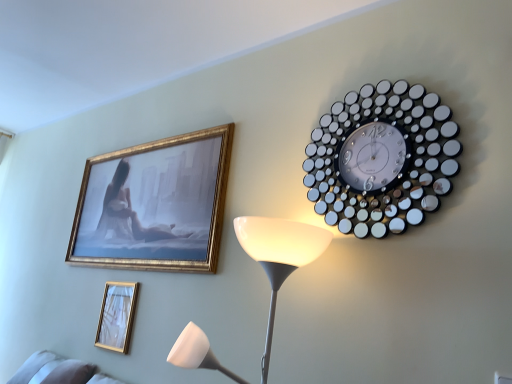
Question: From their relative heights in the image, would you say gold metallic picture frame at lower left is taller or shorter than metallic circular clock at upper right?

Choices:
 (A) tall
 (B) short

Answer: (B)

Question: Based on their sizes in the image, would you say gold metallic picture frame at lower left is bigger or smaller than metallic circular clock at upper right?

Choices:
 (A) big
 (B) small

Answer: (B)

Question: From the image's perspective, is gold metallic picture frame at lower left positioned above or below metallic circular clock at upper right?

Choices:
 (A) below
 (B) above

Answer: (A)

Question: Is point (437, 119) positioned closer to the camera than point (136, 296)?

Choices:
 (A) closer
 (B) farther

Answer: (A)

Question: Is metallic circular clock at upper right inside or outside of gold metallic picture frame at lower left?

Choices:
 (A) inside
 (B) outside

Answer: (B)

Question: From the image's perspective, is metallic circular clock at upper right above or below gold metallic picture frame at lower left?

Choices:
 (A) above
 (B) below

Answer: (A)

Question: Considering the positions of metallic circular clock at upper right and gold metallic picture frame at lower left in the image, is metallic circular clock at upper right bigger or smaller than gold metallic picture frame at lower left?

Choices:
 (A) small
 (B) big

Answer: (B)